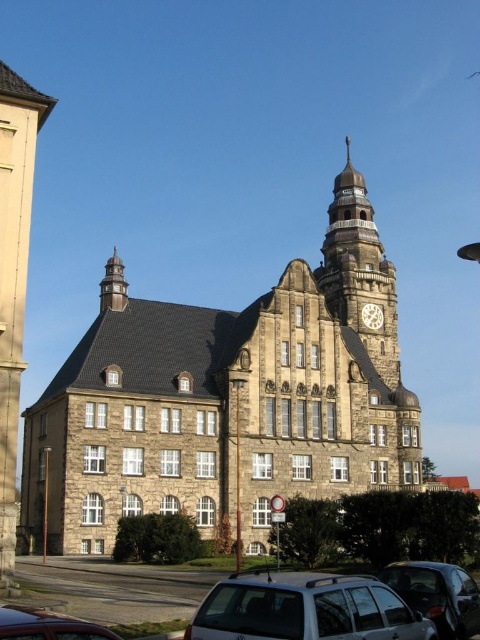
Who is more distant from viewer, (10, 362) or (328, 307)?

Positioned behind is point (328, 307).

From the picture: Is stone tower at left positioned behind stone clock tower at upper center?

That is False.

Is point (24, 234) positioned before point (346, 250)?

Yes, point (24, 234) is closer to viewer.

Locate an element on the screen. This screenshot has height=640, width=480. stone tower at left is located at coordinates (13, 280).

Is stone tower at left behind gold metallic clock at upper center?

No, it is in front of gold metallic clock at upper center.

Does stone tower at left have a greater height compared to gold metallic clock at upper center?

Yes.

Does point (20, 264) lie in front of point (377, 324)?

Yes, it is.

Where is `stone tower at left`? stone tower at left is located at coordinates (13, 280).

Which is more to the right, metallic silver car at lower right or gold metallic clock at upper center?

From the viewer's perspective, gold metallic clock at upper center appears more on the right side.

Does point (402, 577) come farther from viewer compared to point (372, 320)?

No, (402, 577) is in front of (372, 320).

Which is behind, point (439, 572) or point (364, 317)?

Point (364, 317)

This screenshot has height=640, width=480. Find the location of `metallic silver car at lower right`. metallic silver car at lower right is located at coordinates (437, 595).